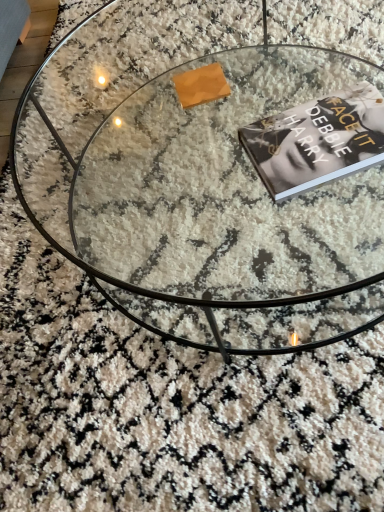
Question: From a real-world perspective, is black matte book at center located higher than transparent glass coffee table at center?

Choices:
 (A) yes
 (B) no

Answer: (A)

Question: Could you tell me if black matte book at center is turned towards transparent glass coffee table at center?

Choices:
 (A) no
 (B) yes

Answer: (A)

Question: Does black matte book at center come in front of transparent glass coffee table at center?

Choices:
 (A) no
 (B) yes

Answer: (A)

Question: Can you confirm if black matte book at center is smaller than transparent glass coffee table at center?

Choices:
 (A) yes
 (B) no

Answer: (A)

Question: Is transparent glass coffee table at center at the back of black matte book at center?

Choices:
 (A) yes
 (B) no

Answer: (B)

Question: Is black matte book at center to the right of transparent glass coffee table at center from the viewer's perspective?

Choices:
 (A) no
 (B) yes

Answer: (B)

Question: Does transparent glass coffee table at center have a larger size compared to black matte book at center?

Choices:
 (A) yes
 (B) no

Answer: (A)

Question: From the image's perspective, is transparent glass coffee table at center located above black matte book at center?

Choices:
 (A) no
 (B) yes

Answer: (B)

Question: Is transparent glass coffee table at center facing away from black matte book at center?

Choices:
 (A) yes
 (B) no

Answer: (B)

Question: Does transparent glass coffee table at center have a smaller size compared to black matte book at center?

Choices:
 (A) no
 (B) yes

Answer: (A)

Question: Can we say transparent glass coffee table at center lies outside black matte book at center?

Choices:
 (A) yes
 (B) no

Answer: (A)

Question: Is transparent glass coffee table at center oriented towards black matte book at center?

Choices:
 (A) no
 (B) yes

Answer: (A)

Question: In terms of size, does black matte book at center appear bigger or smaller than transparent glass coffee table at center?

Choices:
 (A) small
 (B) big

Answer: (A)